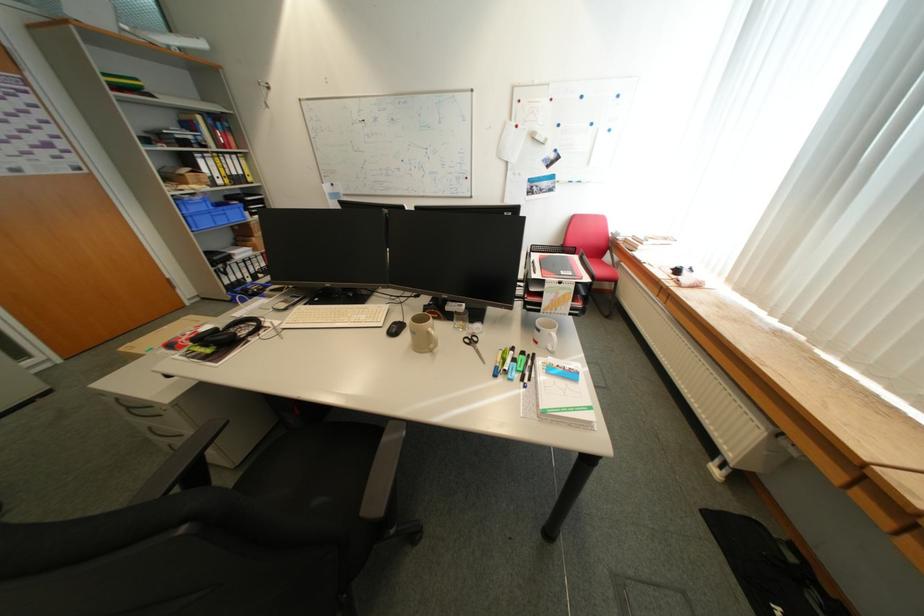
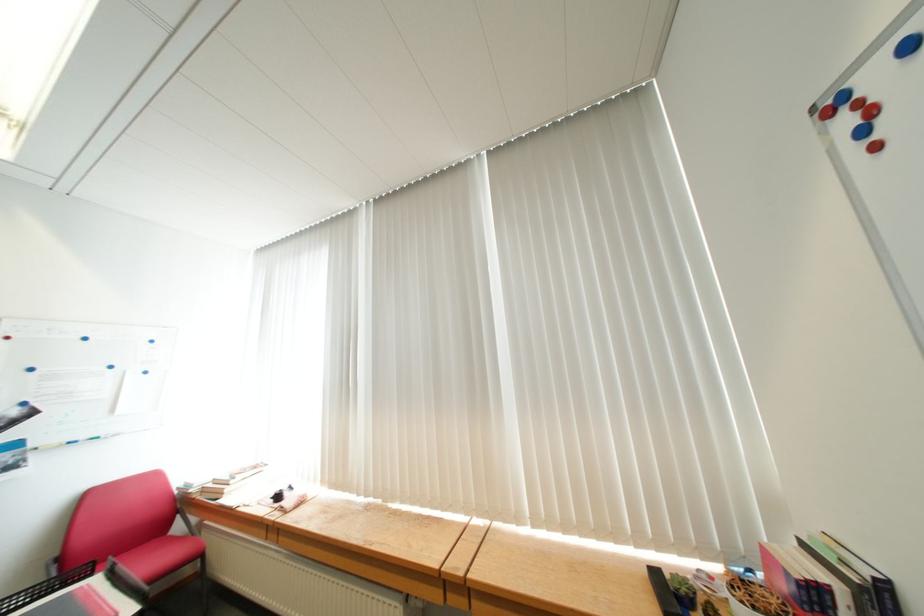
The first image is from the beginning of the video and the second image is from the end. How did the camera likely rotate when shooting the video?

The camera's rotation is toward right-up.